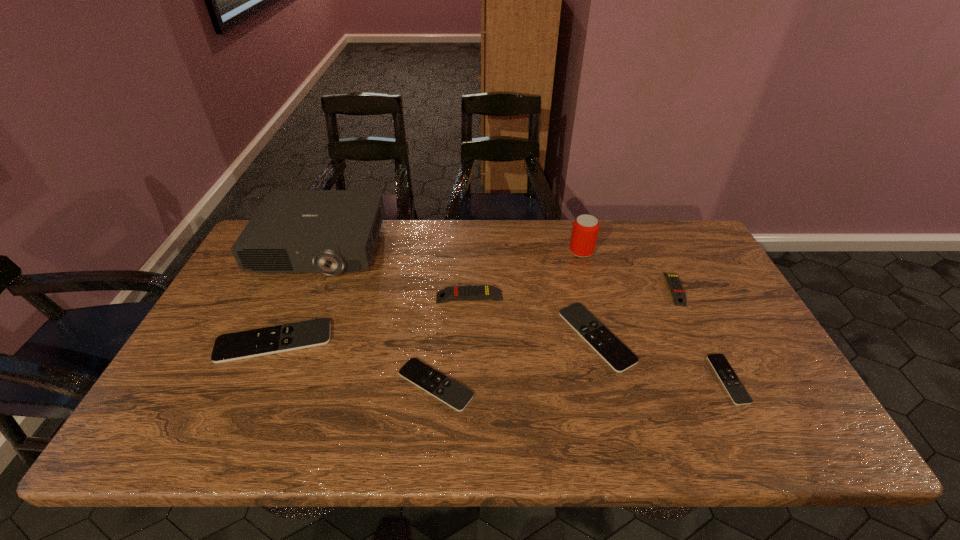
Locate an element on the screen. This screenshot has height=540, width=960. projector is located at coordinates (293, 231).

At what (x,y) coordinates should I click in order to perform the action: click on red beer can. Please return your answer as a coordinate pair (x, y). The height and width of the screenshot is (540, 960). Looking at the image, I should click on (585, 229).

Where is `the tallest remote control`? Image resolution: width=960 pixels, height=540 pixels. the tallest remote control is located at coordinates (478, 292).

Locate an element on the screen. The height and width of the screenshot is (540, 960). the left yellow remote control is located at coordinates (478, 292).

I want to click on the fifth shortest object, so click(679, 297).

The image size is (960, 540). I want to click on the right yellow remote control, so click(679, 297).

Identify the location of the biggest black remote control. pyautogui.click(x=228, y=347).

Locate an element on the screen. the leftmost remote control is located at coordinates (228, 347).

Identify the location of the third shortest remote control. The height and width of the screenshot is (540, 960). (620, 358).

Identify the location of the third shortest object. (620, 358).